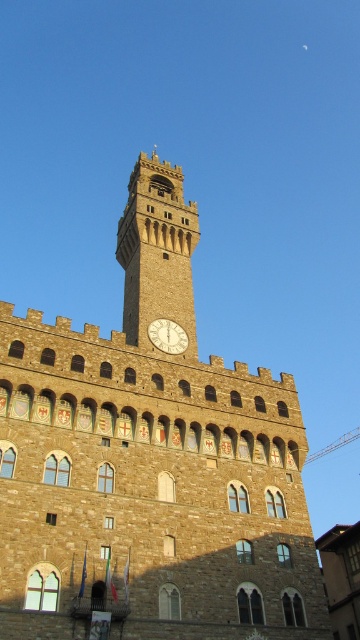
Question: Does brown stone clock tower at center appear under white glossy clock at center?

Choices:
 (A) no
 (B) yes

Answer: (A)

Question: Which point is farther to the camera?

Choices:
 (A) brown stone clock tower at center
 (B) white glossy clock at center

Answer: (B)

Question: Can you confirm if stone clock tower at center is thinner than white glossy clock at center?

Choices:
 (A) yes
 (B) no

Answer: (B)

Question: Estimate the real-world distances between objects in this image. Which object is closer to the stone clock tower at center?

Choices:
 (A) white glossy clock at center
 (B) brown stone clock tower at center

Answer: (A)

Question: Can you confirm if brown stone clock tower at center is positioned to the right of white glossy clock at center?

Choices:
 (A) yes
 (B) no

Answer: (B)

Question: Which point appears farthest from the camera in this image?

Choices:
 (A) (141, 284)
 (B) (167, 332)

Answer: (A)